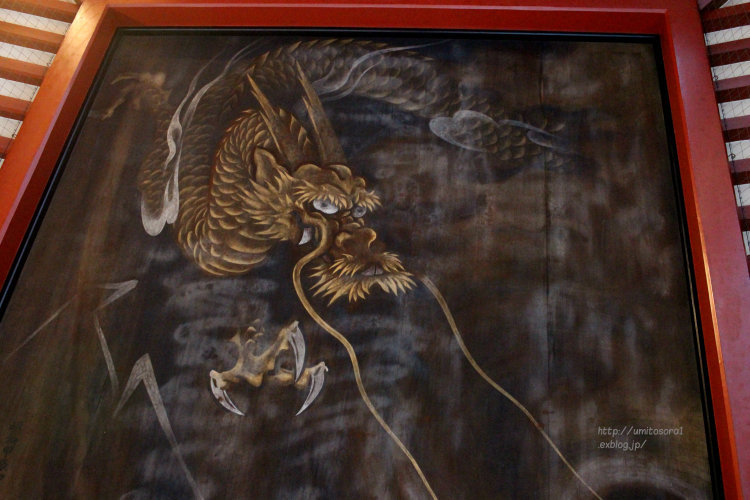
Where is `scales`? scales is located at coordinates (231, 235).